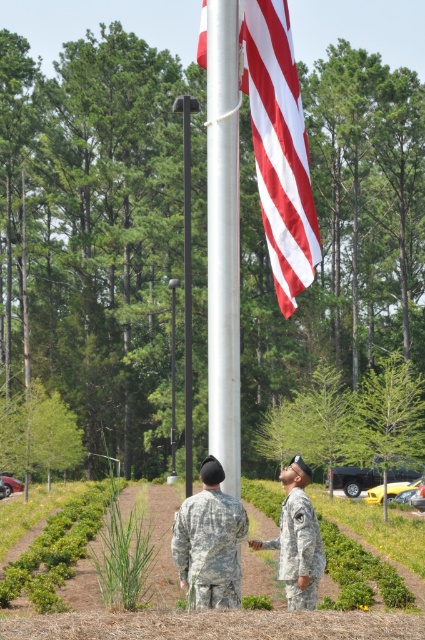
You are a photographer trying to capture a photo of both the camouflage fabric uniform at lower center and the camouflage uniform at center. Since you can only focus on one at a time, which one should you focus on first if you want to include both in the frame without moving the camera?

You should focus on the camouflage fabric uniform at lower center first because it is positioned to the left of the camouflage uniform at center, allowing you to adjust the focus between them while keeping the camera stationary.

You are a visitor at this military installation and want to take a photo of the silver metallic flag pole at center and the camouflage uniform at center. Which object should you focus on first if you want to capture both in the same frame without moving your camera?

You should focus on the silver metallic flag pole at center first because it is positioned to the left of the camouflage uniform at center, so keeping it centered will allow both objects to be included in the frame.